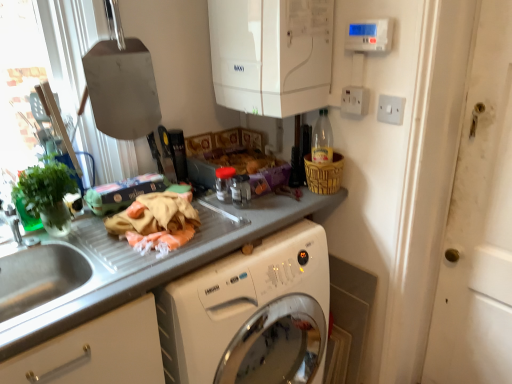
Locate an element on the screen. This screenshot has width=512, height=384. vacant region below green matte plant at left (from a real-world perspective) is located at coordinates (62, 238).